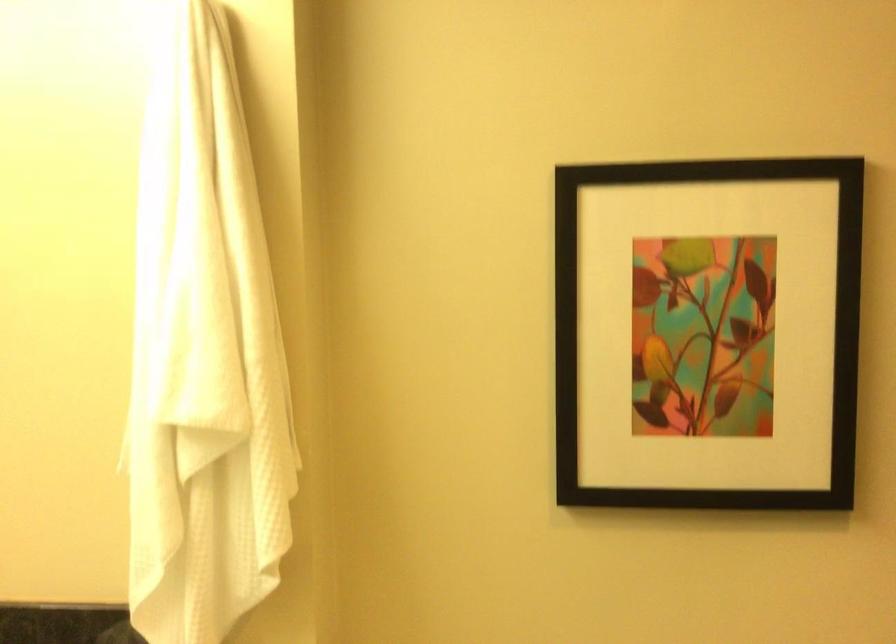
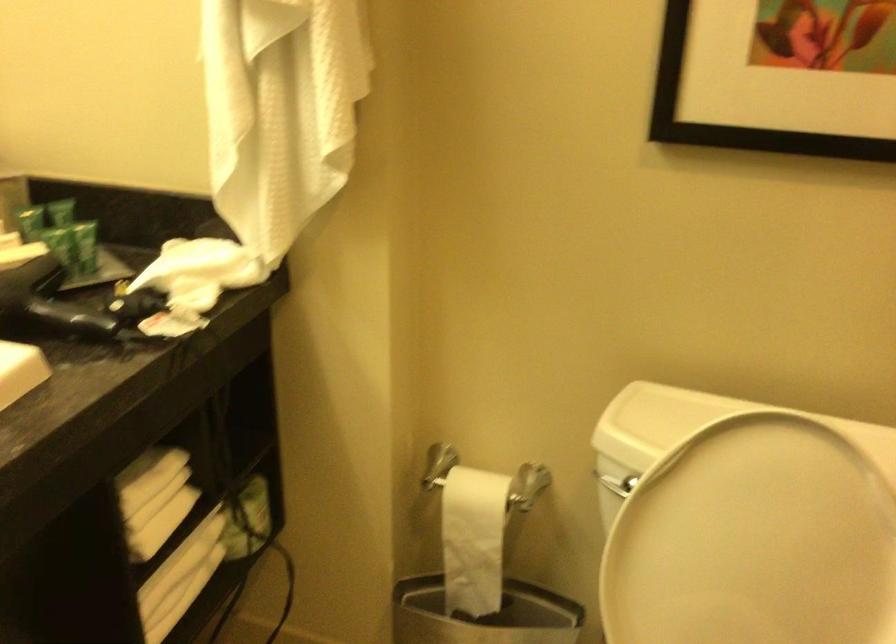
Question: Which direction would the cameraman need to move to produce the second image? Reply with the corresponding letter.

Choices:
 (A) Left
 (B) Right
 (C) Forward
 (D) Backward

Answer: (B)